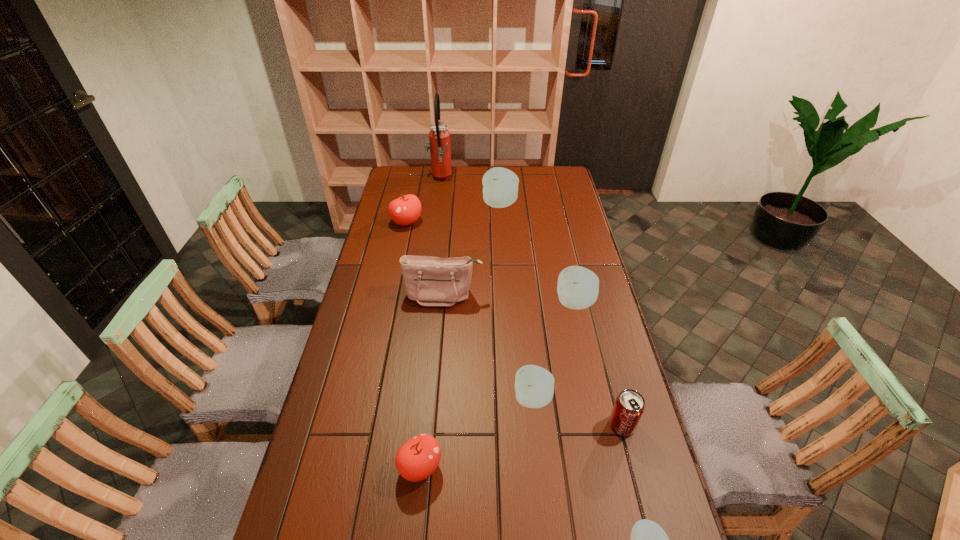
You are a GUI agent. You are given a task and a screenshot of the screen. Output one action in this format:
    pyautogui.click(x=<x>, y=<y>)
    Task: Click on the blank space at the far right corner
    The width and height of the screenshot is (960, 540).
    Given the screenshot: What is the action you would take?
    pyautogui.click(x=541, y=172)

The image size is (960, 540). Identify the location of free space between the shoulder bag and the second smallest white apple. (489, 347).

The height and width of the screenshot is (540, 960). I want to click on free space that is in between the tallest object and the shoulder bag, so (442, 238).

The image size is (960, 540). In order to click on vacant area between the shoulder bag and the biggest white apple in this screenshot , I will do `click(471, 250)`.

Where is `blank region between the second farthest white apple and the biggest white apple`? This screenshot has height=540, width=960. blank region between the second farthest white apple and the biggest white apple is located at coordinates click(538, 254).

At what (x,y) coordinates should I click in order to perform the action: click on empty space between the second farthest white apple and the farthest white apple. Please return your answer as a coordinate pair (x, y). This screenshot has width=960, height=540. Looking at the image, I should click on (538, 254).

Where is `free point between the second smallest white apple and the left red apple`? This screenshot has height=540, width=960. free point between the second smallest white apple and the left red apple is located at coordinates (469, 310).

Identify the location of the closest object to the shortest object. The width and height of the screenshot is (960, 540). (629, 406).

Select which object is the fifth closest to the fire extinguisher. Please provide its 2D coordinates. Your answer should be formatted as a tuple, i.e. [(x, y)], where the tuple contains the x and y coordinates of a point satisfying the conditions above.

[(534, 385)]

You are a GUI agent. You are given a task and a screenshot of the screen. Output one action in this format:
    pyautogui.click(x=<x>, y=<y>)
    Task: Click on the apple that is the closest one to the red pop soda
    The width and height of the screenshot is (960, 540).
    Given the screenshot: What is the action you would take?
    pyautogui.click(x=534, y=385)